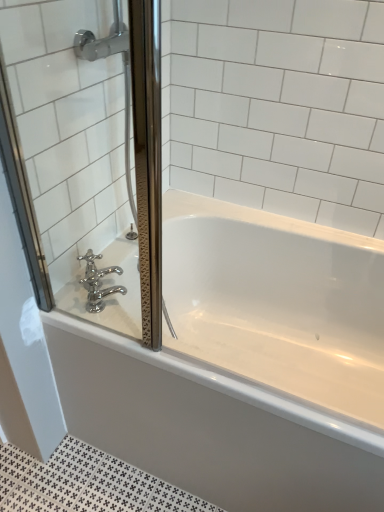
Question: Is point (66, 293) positioned closer to the camera than point (193, 433)?

Choices:
 (A) farther
 (B) closer

Answer: (A)

Question: Choose the correct answer: Is clear glass screen door at left inside white glossy bathtub at center or outside it?

Choices:
 (A) outside
 (B) inside

Answer: (A)

Question: Which object is the farthest from the clear glass screen door at left?

Choices:
 (A) polished chrome faucet at lower left
 (B) white glossy bathtub at center

Answer: (B)

Question: Which object is positioned farthest from the polished chrome faucet at lower left?

Choices:
 (A) clear glass screen door at left
 (B) white glossy bathtub at center

Answer: (B)